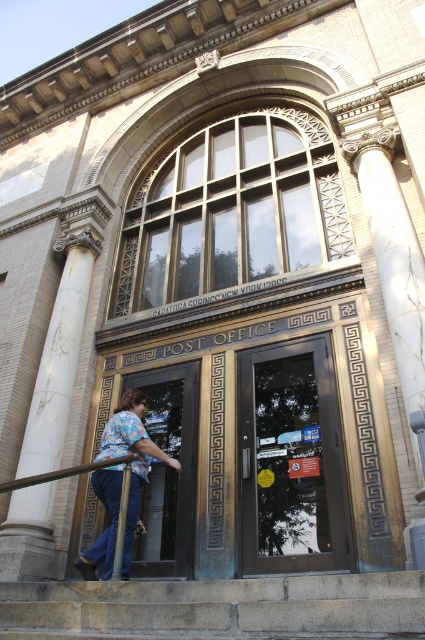
Question: In this image, where is gray stone steps at lower center located relative to matte glass door at center?

Choices:
 (A) above
 (B) below

Answer: (B)

Question: Which point is farther to the camera?

Choices:
 (A) (153, 380)
 (B) (116, 586)
 (C) (118, 497)

Answer: (A)

Question: Which of these objects is positioned farthest from the matte glass door at center?

Choices:
 (A) gray stone steps at lower center
 (B) white marble column at left
 (C) shiny dark glass door at center
 (D) blue jeans at lower left

Answer: (A)

Question: Which object is farther from the camera taking this photo?

Choices:
 (A) blue jeans at lower left
 (B) gray stone steps at lower center
 (C) matte glass door at center
 (D) white marble column at left

Answer: (C)

Question: Does matte glass door at center appear on the right side of blue jeans at lower left?

Choices:
 (A) yes
 (B) no

Answer: (A)

Question: Is gray stone steps at lower center bigger than white marble column at left?

Choices:
 (A) yes
 (B) no

Answer: (B)